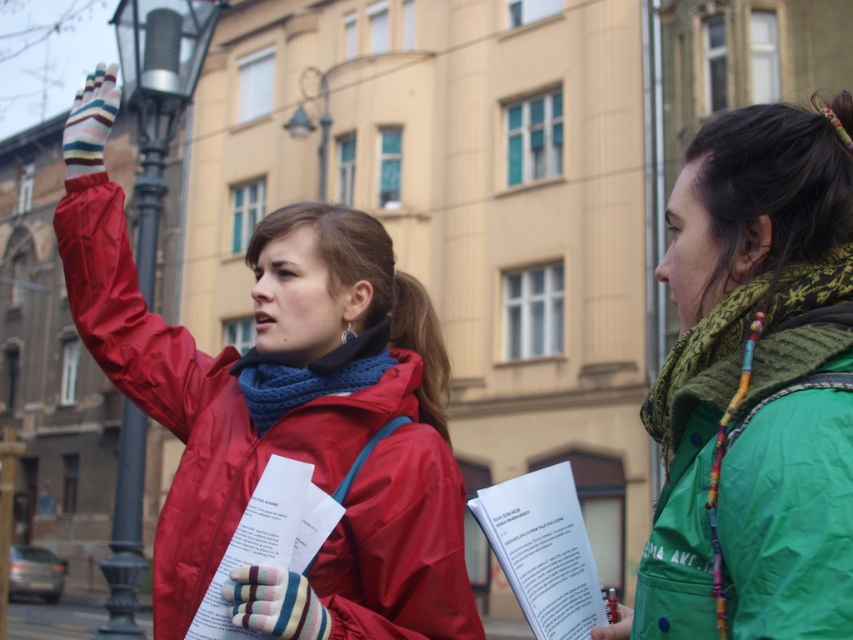
Does green matte jacket at right appear under green knitted scarf at right?

Incorrect, green matte jacket at right is not positioned below green knitted scarf at right.

This screenshot has height=640, width=853. I want to click on green matte jacket at right, so click(x=753, y=385).

Who is higher up, matte red jacket at left or blue knitted scarf at center?

matte red jacket at left is higher up.

The image size is (853, 640). What do you see at coordinates (282, 410) in the screenshot? I see `matte red jacket at left` at bounding box center [282, 410].

The width and height of the screenshot is (853, 640). What are the coordinates of `matte red jacket at left` in the screenshot? It's located at (282, 410).

From the picture: Measure the distance between point (86,186) and camera.

73.78 feet

Does matte red jacket at left appear on the right side of metallic silver lamp post at left?

Correct, you'll find matte red jacket at left to the right of metallic silver lamp post at left.

Is point (306, 356) closer to camera compared to point (142, 465)?

Yes, it is in front of point (142, 465).

Where is `matte red jacket at left`? matte red jacket at left is located at coordinates (282, 410).